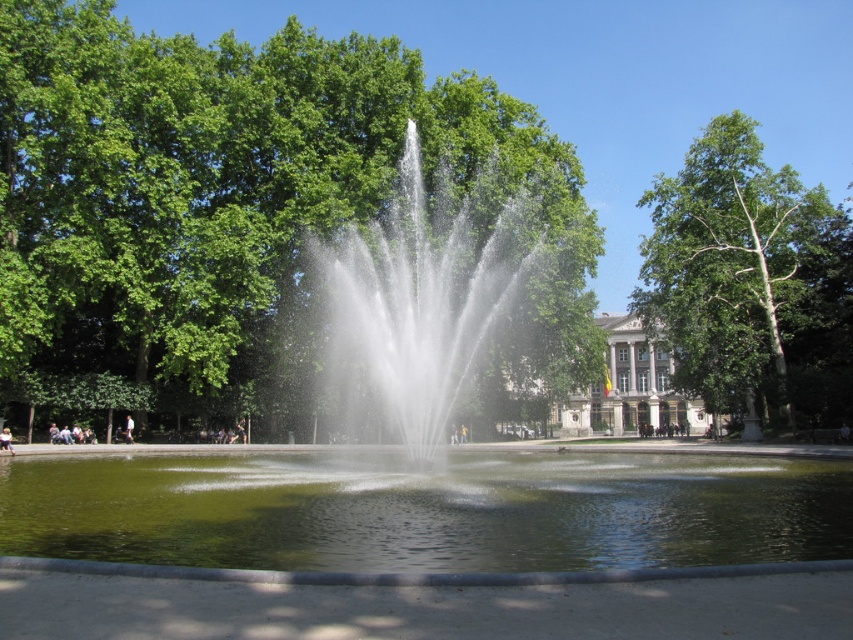
You are standing in the park and want to take a photo of both the clear water fountain at center and the green liquid water at center. Which one should you focus on first if you want to capture both in the same frame without moving your camera?

The clear water fountain at center is positioned on the right side of green liquid water at center, so you should focus on the green liquid water at center first to ensure both are in the frame.